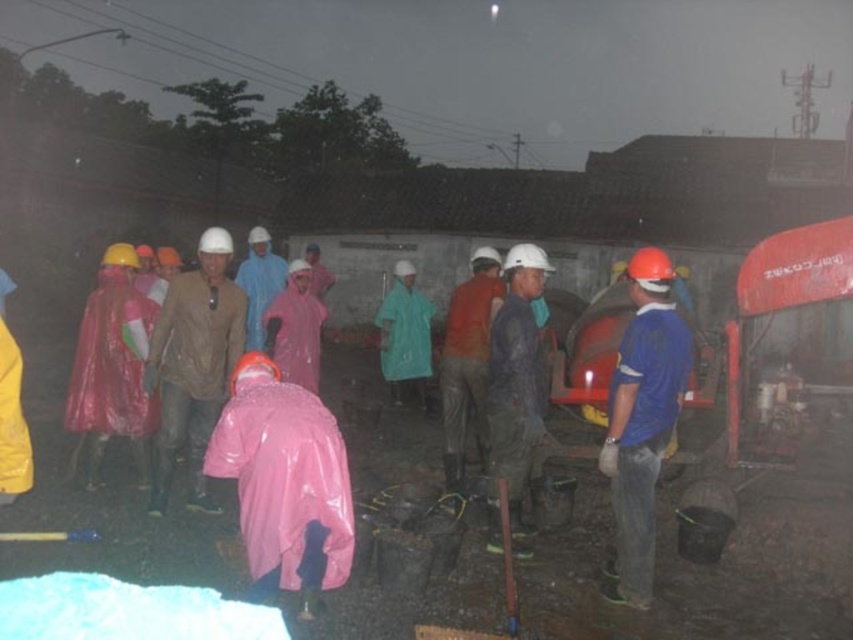
Question: Which object is closer to the camera taking this photo?

Choices:
 (A) wet fabric helmet at center
 (B) matte brown jacket at center

Answer: (A)

Question: Is matte brown jacket at center thinner than wet fabric helmet at center?

Choices:
 (A) yes
 (B) no

Answer: (B)

Question: Does matte brown jacket at center appear on the left side of wet fabric helmet at center?

Choices:
 (A) no
 (B) yes

Answer: (B)

Question: Is matte brown jacket at center further to the viewer compared to wet fabric helmet at center?

Choices:
 (A) yes
 (B) no

Answer: (A)